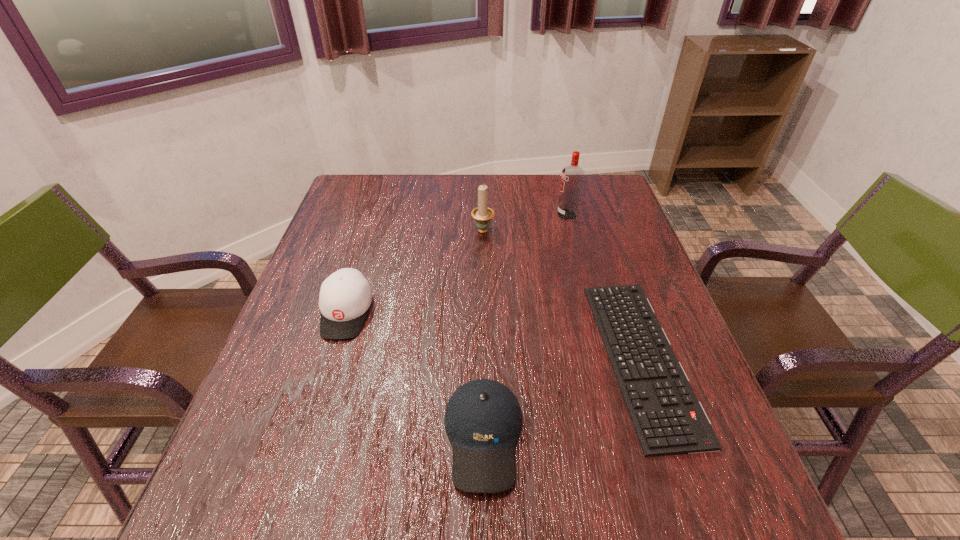
Where is `the fourth closest object to the second shortest object`? This screenshot has width=960, height=540. the fourth closest object to the second shortest object is located at coordinates (572, 177).

I want to click on vacant region that satisfies the following two spatial constraints: 1. on the front label of the farthest object; 2. on the front-facing side of the leftmost object, so click(x=592, y=313).

This screenshot has width=960, height=540. Identify the location of vacant space that satisfies the following two spatial constraints: 1. on the front label of the tallest object; 2. on the front-facing side of the nearer baseball cap. (625, 437).

At what (x,y) coordinates should I click in order to perform the action: click on vacant space that satisfies the following two spatial constraints: 1. on the front label of the tallest object; 2. on the front-facing side of the leftmost object. Please return your answer as a coordinate pair (x, y). Looking at the image, I should click on (592, 313).

I want to click on free space that satisfies the following two spatial constraints: 1. on the front label of the shortest object; 2. on the left side of the tallest object, so click(604, 358).